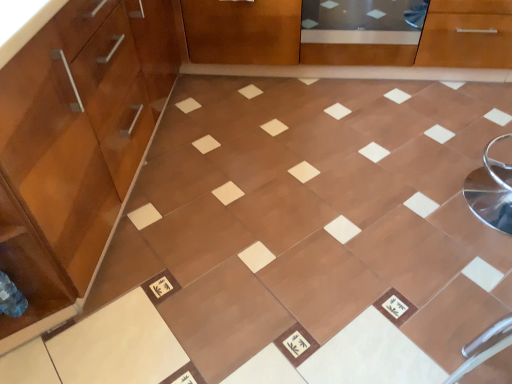
Question: Would you say brown glossy tile at center is to the left or to the right of matte wood cabinetry at left in the picture?

Choices:
 (A) left
 (B) right

Answer: (B)

Question: Is brown glossy tile at center situated inside matte wood cabinetry at left or outside?

Choices:
 (A) inside
 (B) outside

Answer: (B)

Question: Which object is positioned farthest from the brown glossy tile at center?

Choices:
 (A) transparent glass screen door at upper center
 (B) matte wood cabinetry at left

Answer: (A)

Question: Which of these objects is positioned closest to the brown glossy tile at center?

Choices:
 (A) transparent glass screen door at upper center
 (B) matte wood cabinetry at left

Answer: (B)